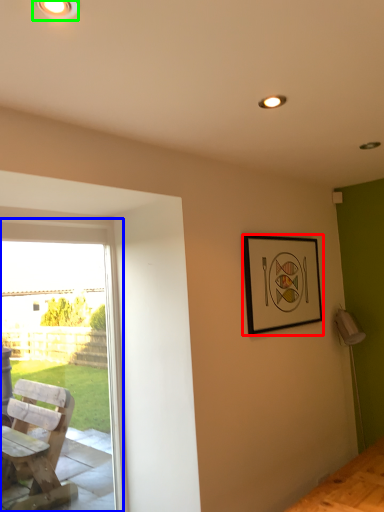
Question: Considering the real-world distances, which object is closest to picture frame (highlighted by a red box)? window (highlighted by a blue box) or light fixture (highlighted by a green box).

Choices:
 (A) window
 (B) light fixture

Answer: (A)